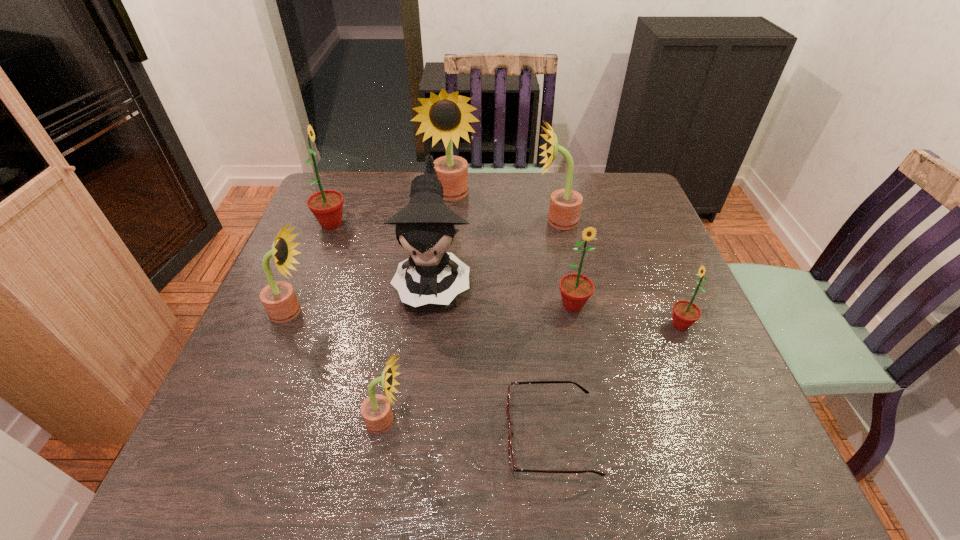
Locate an element on the screen. The image size is (960, 540). free region located at the face of the doll is located at coordinates (421, 394).

I want to click on vacant space located 0.070m on the face of the third biggest yellow sunflower, so click(x=344, y=312).

At what (x,y) coordinates should I click in order to perform the action: click on free space located 0.160m on the face of the second smallest green sunflower. Please return your answer as a coordinate pair (x, y). This screenshot has height=540, width=960. Looking at the image, I should click on (588, 378).

Locate an element on the screen. vacant region located on the face of the smallest yellow sunflower is located at coordinates (459, 421).

The height and width of the screenshot is (540, 960). I want to click on free space located on the face of the rightmost sunflower, so click(x=517, y=325).

Find the location of a particular element. This screenshot has height=540, width=960. free space located 0.380m on the face of the rightmost sunflower is located at coordinates (499, 325).

You are a GUI agent. You are given a task and a screenshot of the screen. Output one action in this format:
    pyautogui.click(x=<x>, y=<y>)
    Task: Click on the blank space located on the face of the rightmost sunflower
    
    Given the screenshot: What is the action you would take?
    pyautogui.click(x=565, y=325)

Identify the location of free space located 0.060m on the lenses of the spectacles. This screenshot has width=960, height=540. (474, 435).

Where is `free space located on the lenses of the spectacles`? The image size is (960, 540). free space located on the lenses of the spectacles is located at coordinates (317, 435).

Where is `free space located on the lenses of the spectacles`? The image size is (960, 540). free space located on the lenses of the spectacles is located at coordinates (420, 435).